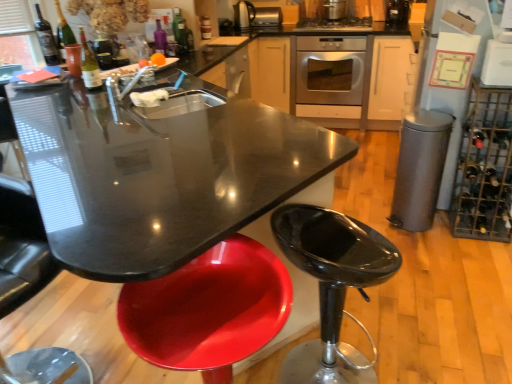
What is the approximate height of matte glass bottle at center, positioned as the 1th bottle in top-to-bottom order?

matte glass bottle at center, positioned as the 1th bottle in top-to-bottom order, is 10.38 centimeters tall.

This screenshot has width=512, height=384. Describe the element at coordinates (89, 65) in the screenshot. I see `matte glass bottle at upper left, which is counted as the 1th bottle, starting from the bottom` at that location.

The image size is (512, 384). What do you see at coordinates (420, 169) in the screenshot?
I see `metallic gray trash can at right, marked as the second appliance in a right-to-left arrangement` at bounding box center [420, 169].

I want to click on stainless steel oven at center, so click(x=330, y=70).

Considering their positions, is stainless steel oven at center located in front of or behind stainless steel oven at center?

stainless steel oven at center is positioned farther from the viewer than stainless steel oven at center.

Is stainless steel oven at center inside stainless steel oven at center?

No, stainless steel oven at center is located outside of stainless steel oven at center.

In terms of height, does stainless steel oven at center look taller or shorter compared to stainless steel oven at center?

In the image, stainless steel oven at center appears to be taller than stainless steel oven at center.

Is stainless steel oven at center oriented away from stainless steel oven at center?

No, stainless steel oven at center is not facing away from stainless steel oven at center.

Considering the sizes of objects green glass wine bottle at upper center, acting as the third wine bottle starting from the front, and metallic silver toaster at upper center, the 3th appliance in the bottom-to-top sequence, in the image provided, who is wider, green glass wine bottle at upper center, acting as the third wine bottle starting from the front, or metallic silver toaster at upper center, the 3th appliance in the bottom-to-top sequence,?

metallic silver toaster at upper center, the 3th appliance in the bottom-to-top sequence, is wider.

Is green glass wine bottle at upper center, the 1th wine bottle positioned from the back, situated inside metallic silver toaster at upper center, which is the 3th appliance in right-to-left order, or outside?

green glass wine bottle at upper center, the 1th wine bottle positioned from the back, is outside metallic silver toaster at upper center, which is the 3th appliance in right-to-left order.

Does green glass wine bottle at upper center, the third wine bottle positioned from the left, turn towards metallic silver toaster at upper center, which ranks as the 3th appliance in back-to-front order?

No, green glass wine bottle at upper center, the third wine bottle positioned from the left, is not facing towards metallic silver toaster at upper center, which ranks as the 3th appliance in back-to-front order.

Which is more to the left, green glass wine bottle at upper center, the 1th wine bottle viewed from the right, or metallic silver toaster at upper center, which ranks as the 3th appliance in back-to-front order?

green glass wine bottle at upper center, the 1th wine bottle viewed from the right.

Would you say matte glass bottle at center, the 3th bottle from the front, is part of matte black wine bottle at upper left, the first wine bottle from the left,'s contents?

No, matte glass bottle at center, the 3th bottle from the front, is not surrounded by matte black wine bottle at upper left, the first wine bottle from the left.

Which object is closer to the camera taking this photo, matte black wine bottle at upper left, marked as the 1th wine bottle in a front-to-back arrangement, or matte glass bottle at center, the third bottle when ordered from bottom to top?

matte black wine bottle at upper left, marked as the 1th wine bottle in a front-to-back arrangement, is closer to the camera.

Considering the positions of points (205, 310) and (187, 29), is point (205, 310) farther from camera compared to point (187, 29)?

No, (205, 310) is closer to viewer.

Measure the distance from glossy plastic stool at lower left to green glass wine bottle at upper center, the 1th wine bottle viewed from the right.

glossy plastic stool at lower left is 2.40 meters away from green glass wine bottle at upper center, the 1th wine bottle viewed from the right.

Considering the sizes of glossy plastic stool at lower left and green glass wine bottle at upper center, acting as the third wine bottle starting from the front, in the image, is glossy plastic stool at lower left taller or shorter than green glass wine bottle at upper center, acting as the third wine bottle starting from the front,?

glossy plastic stool at lower left is taller than green glass wine bottle at upper center, acting as the third wine bottle starting from the front.

From the image's perspective, who appears lower, glossy plastic stool at lower left or green glass wine bottle at upper center, the 1th wine bottle viewed from the right?

glossy plastic stool at lower left appears lower in the image.

Which is correct: metallic stainless steel toaster at upper center, which is the fourth appliance from right to left, is inside metallic wire wine rack at right, or outside of it?

metallic stainless steel toaster at upper center, which is the fourth appliance from right to left, is not inside metallic wire wine rack at right, it's outside.

Consider the image. From a real-world perspective, who is located lower, metallic stainless steel toaster at upper center, which is the first appliance from back to front, or metallic wire wine rack at right?

In real-world perspective, metallic wire wine rack at right is lower.

From the image's perspective, which one is positioned higher, metallic stainless steel toaster at upper center, which is the fourth appliance from right to left, or metallic wire wine rack at right?

metallic stainless steel toaster at upper center, which is the fourth appliance from right to left, appears higher in the image.

Looking at this image, is metallic stainless steel toaster at upper center, which is the first appliance from back to front, oriented away from metallic wire wine rack at right?

No, metallic stainless steel toaster at upper center, which is the first appliance from back to front, is not facing away from metallic wire wine rack at right.

Considering the sizes of objects matte black wine bottle at upper left, the first wine bottle from the left, and metallic stainless steel toaster at upper center, the 5th appliance from the bottom, in the image provided, who is taller, matte black wine bottle at upper left, the first wine bottle from the left, or metallic stainless steel toaster at upper center, the 5th appliance from the bottom,?

matte black wine bottle at upper left, the first wine bottle from the left, is taller.

Which point is more forward, (50, 57) or (251, 22)?

The point (50, 57) is more forward.

Would you consider matte black wine bottle at upper left, marked as the 1th wine bottle in a front-to-back arrangement, to be distant from metallic stainless steel toaster at upper center, marked as the 2th appliance in a left-to-right arrangement?

Absolutely, matte black wine bottle at upper left, marked as the 1th wine bottle in a front-to-back arrangement, is distant from metallic stainless steel toaster at upper center, marked as the 2th appliance in a left-to-right arrangement.

Is matte black wine bottle at upper left, the first wine bottle from the left, to the right of matte glass wine bottle at upper left, the 2th wine bottle in the front-to-back sequence, from the viewer's perspective?

No, matte black wine bottle at upper left, the first wine bottle from the left, is not to the right of matte glass wine bottle at upper left, the 2th wine bottle in the front-to-back sequence.

This screenshot has height=384, width=512. In order to click on wine bottle located on the left of matte glass wine bottle at upper left, which is the second wine bottle from back to front in this screenshot , I will do `click(46, 39)`.

Which point is more forward, (44, 33) or (65, 28)?

The point (44, 33) is closer to the camera.

From the image's perspective, between matte black wine bottle at upper left, which ranks as the 3th wine bottle in right-to-left order, and matte glass wine bottle at upper left, the 2th wine bottle in the front-to-back sequence, which one is located above?

matte glass wine bottle at upper left, the 2th wine bottle in the front-to-back sequence, from the image's perspective.

At what (x,y) coordinates should I click in order to perform the action: click on home appliance behind the stainless steel oven at center. Please return your answer as a coordinate pair (x, y). Looking at the image, I should click on (330, 70).

Image resolution: width=512 pixels, height=384 pixels. What are the coordinates of `wine bottle directly beneath the metallic silver toaster at upper center, the third appliance in the top-to-bottom sequence (from a real-world perspective)` in the screenshot? It's located at (184, 38).

Considering their positions, is metallic silver kettle at upper center, which is counted as the 2th appliance, starting from the top, positioned closer to matte black wine bottle at upper left, the first wine bottle from the left, than matte glass bottle at upper left, which is the 3th bottle in back-to-front order?

Based on the image, matte glass bottle at upper left, which is the 3th bottle in back-to-front order, appears to be nearer to matte black wine bottle at upper left, the first wine bottle from the left.

Considering their positions, is matte glass bottle at upper center, which ranks as the second bottle in back-to-front order, positioned further to matte black wine bottle at upper left, marked as the 1th wine bottle in a front-to-back arrangement, than stainless steel oven at center?

Among the two, stainless steel oven at center is located further to matte black wine bottle at upper left, marked as the 1th wine bottle in a front-to-back arrangement.

Estimate the real-world distances between objects in this image. Which object is closer to glossy black countertop at center, metallic stainless steel toaster at upper center, which is the first appliance from back to front, or matte black wine bottle at upper left, marked as the 1th wine bottle in a front-to-back arrangement?

Among the two, matte black wine bottle at upper left, marked as the 1th wine bottle in a front-to-back arrangement, is located nearer to glossy black countertop at center.

Based on their spatial positions, is matte glass bottle at upper left, acting as the 3th bottle starting from the right, or matte glass wine bottle at upper left, the second wine bottle positioned from the right, further from metallic wire wine rack at right?

Among the two, matte glass wine bottle at upper left, the second wine bottle positioned from the right, is located further to metallic wire wine rack at right.

Based on their spatial positions, is white glossy refrigerator at upper right, which is the 5th appliance in back-to-front order, or matte glass bottle at upper left, the 3th bottle viewed from the top, further from matte glass wine bottle at upper left, the 2th wine bottle in the front-to-back sequence?

Among the two, white glossy refrigerator at upper right, which is the 5th appliance in back-to-front order, is located further to matte glass wine bottle at upper left, the 2th wine bottle in the front-to-back sequence.

Estimate the real-world distances between objects in this image. Which object is further from stainless steel oven at center, glossy plastic swivel chair at lower left or stainless steel oven at center?

Based on the image, glossy plastic swivel chair at lower left appears to be further to stainless steel oven at center.

Based on their spatial positions, is metallic gray trash can at right, acting as the fourth appliance starting from the back, or glossy black countertop at center further from stainless steel oven at center?

glossy black countertop at center is positioned further to the anchor stainless steel oven at center.

Looking at this image, from the image, which object appears to be farther from glossy black countertop at center, stainless steel oven at center or matte glass wine bottle at upper left, positioned as the second wine bottle in left-to-right order?

stainless steel oven at center.

At what (x,y) coordinates should I click in order to perform the action: click on kitchen appliance between metallic gray trash can at right, arranged as the 5th appliance when viewed from the top, and stainless steel oven at center in the front-back direction. Please return your answer as a coordinate pair (x, y). Image resolution: width=512 pixels, height=384 pixels. Looking at the image, I should click on (335, 24).

At what (x,y) coordinates should I click in order to perform the action: click on wine bottle between matte glass bottle at upper center, which is the second bottle from front to back, and metallic silver kettle at upper center, the 4th appliance in the bottom-to-top sequence, along the z-axis. Please return your answer as a coordinate pair (x, y). Looking at the image, I should click on [184, 38].

The image size is (512, 384). I want to click on home appliance between glossy plastic stool at lower left and metallic silver kettle at upper center, acting as the first appliance starting from the left, along the z-axis, so click(330, 70).

I want to click on wine rack positioned between glossy black countertop at center and green glass wine bottle at upper center, the third wine bottle positioned from the left, from near to far, so (x=484, y=167).